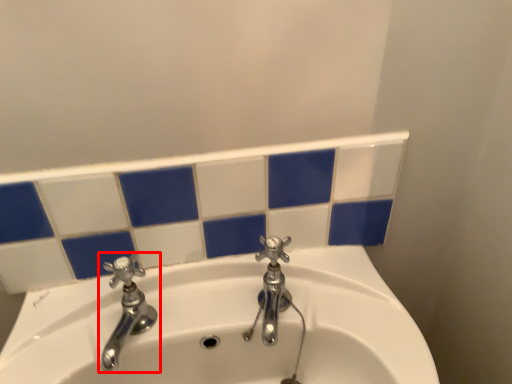
Question: From the image's perspective, where is tap (annotated by the red box) located in relation to tap in the image?

Choices:
 (A) below
 (B) above

Answer: (A)